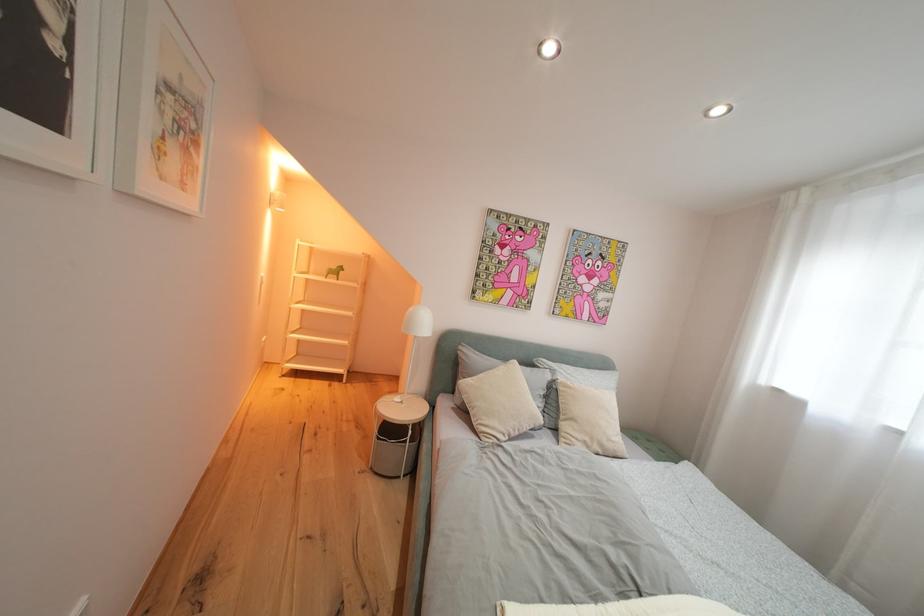
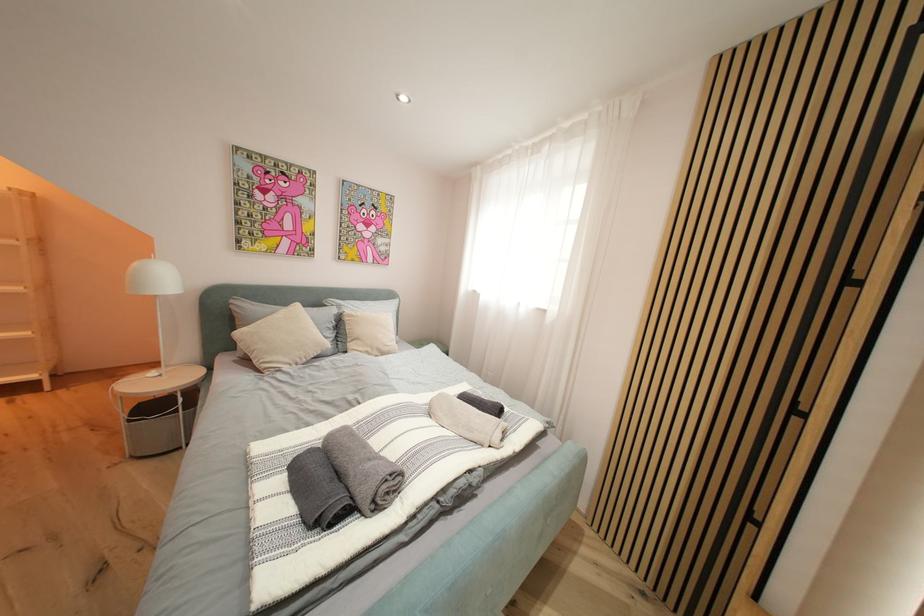
Question: Based on the continuous images, in which direction is the camera rotating? Reply with the corresponding letter.

Choices:
 (A) Left
 (B) Right
 (C) Up
 (D) Down

Answer: (B)